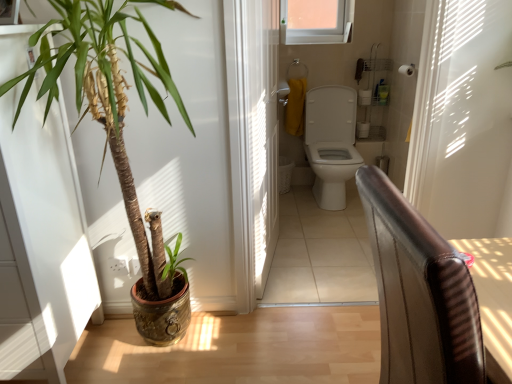
Identify the location of vacant region below translucent plastic screen door at center (from a real-world perspective). (275, 258).